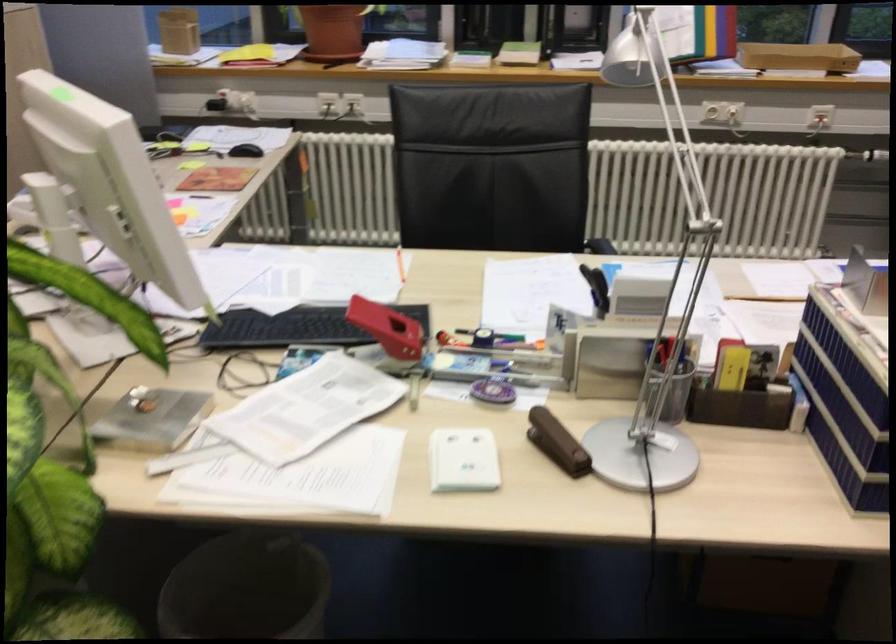
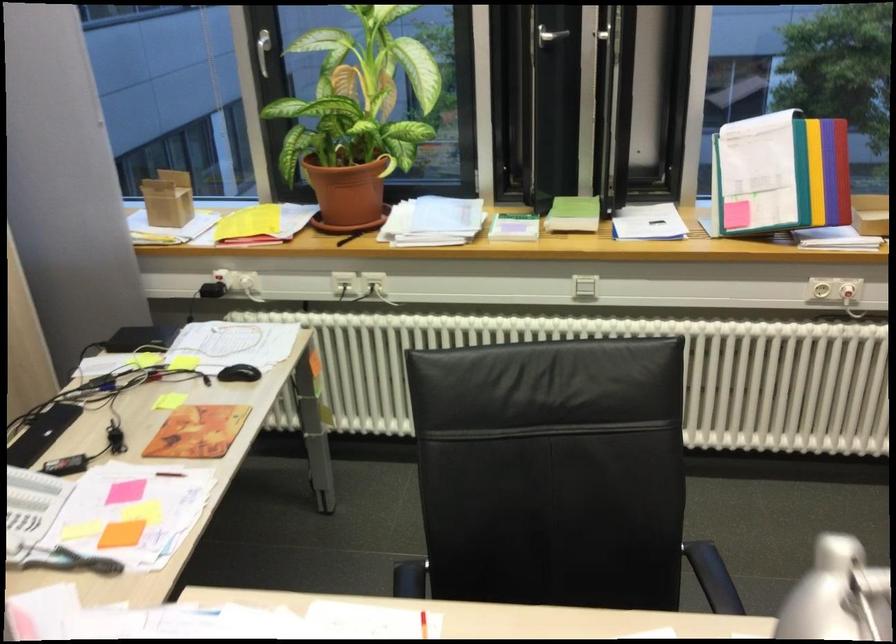
Question: Based on the continuous images, in which direction is the camera rotating? Reply with the corresponding letter.

Choices:
 (A) Left
 (B) Right
 (C) Up
 (D) Down

Answer: (A)